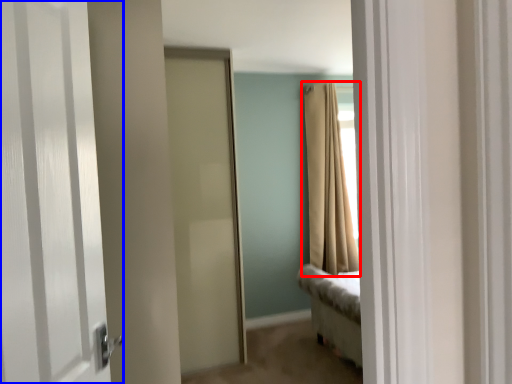
Question: Which point is closer to the camera, curtain (highlighted by a red box) or door (highlighted by a blue box)?

Choices:
 (A) curtain
 (B) door

Answer: (B)